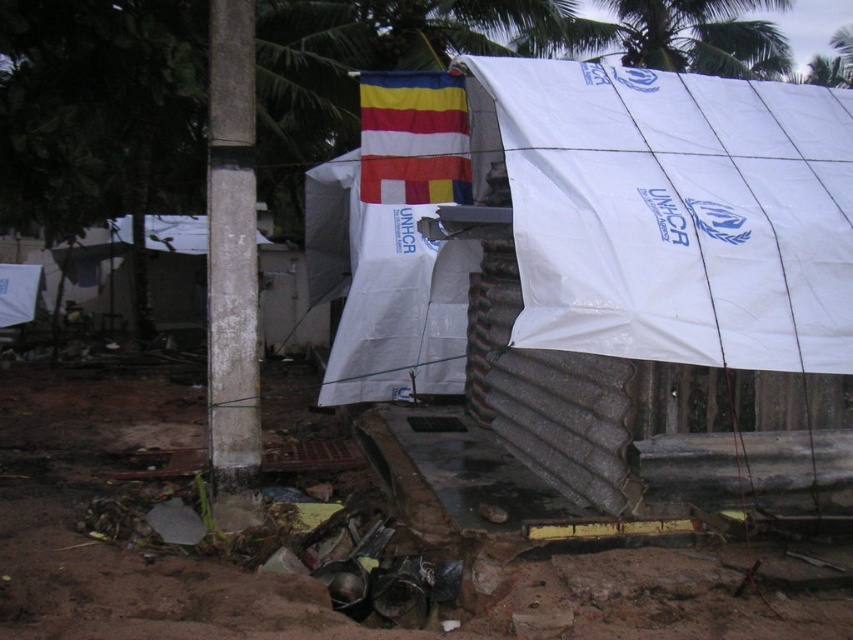
Measure the distance between point (680, 310) and camera.

Point (680, 310) and camera are 4.73 meters apart.

Can you confirm if white plastic tent at upper center is taller than brown dirt at lower left?

In fact, white plastic tent at upper center may be shorter than brown dirt at lower left.

Locate an element on the screen. The image size is (853, 640). white plastic tent at upper center is located at coordinates 621,276.

Does white plastic tent at upper center have a smaller size compared to striped fabric flag at upper center?

Yes.

Is white plastic tent at upper center taller than striped fabric flag at upper center?

No.

I want to click on white plastic tent at upper center, so click(621, 276).

Between brown dirt at lower left and striped fabric flag at upper center, which one is positioned lower?

brown dirt at lower left is below.

Which is more to the right, brown dirt at lower left or striped fabric flag at upper center?

striped fabric flag at upper center

Locate an element on the screen. This screenshot has height=640, width=853. brown dirt at lower left is located at coordinates (114, 541).